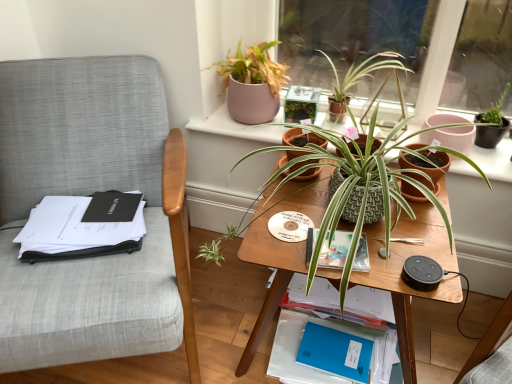
Where is `vacant area that is in front of green textured pot at center, placed as the 2th flowerpot when sorted from right to left`? The image size is (512, 384). vacant area that is in front of green textured pot at center, placed as the 2th flowerpot when sorted from right to left is located at coordinates (304, 201).